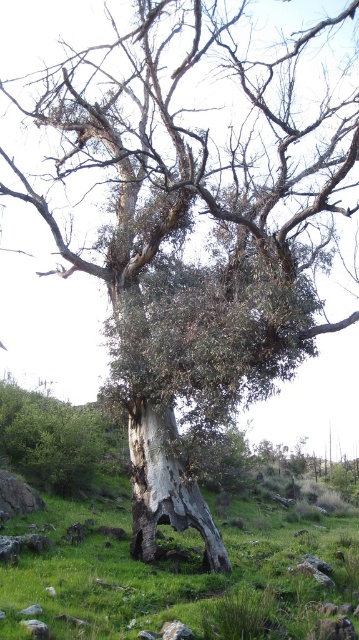
Which is more to the left, green grass at center or gray rough bark tree trunk at center?

Positioned to the left is gray rough bark tree trunk at center.

Which of these two, green grass at center or gray rough bark tree trunk at center, stands shorter?

With less height is gray rough bark tree trunk at center.

Does point (283, 611) come behind point (133, 548)?

No, it is not.

Identify the location of green grass at center. This screenshot has height=640, width=359. click(175, 577).